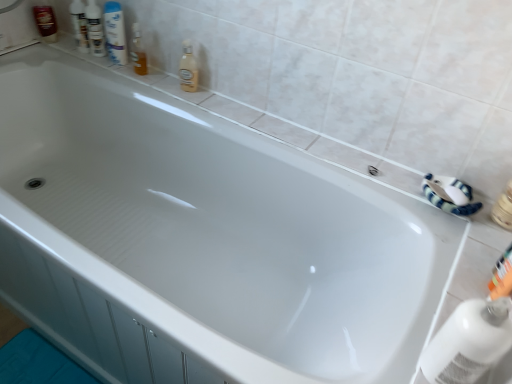
Describe the element at coordinates (46, 22) in the screenshot. I see `shiny brown bottle at upper left, the 5th toiletry viewed from the right` at that location.

The height and width of the screenshot is (384, 512). What do you see at coordinates (138, 51) in the screenshot?
I see `translucent plastic soap dispenser at upper center, placed as the second toiletry when sorted from front to back` at bounding box center [138, 51].

This screenshot has height=384, width=512. What do you see at coordinates (95, 29) in the screenshot?
I see `matte white pump bottle at upper left, marked as the third toiletry in a right-to-left arrangement` at bounding box center [95, 29].

What is the approximate height of white glossy shampoo bottles at upper left, the 4th toiletry positioned from the bottom?

white glossy shampoo bottles at upper left, the 4th toiletry positioned from the bottom, is 20.08 centimeters tall.

The width and height of the screenshot is (512, 384). Describe the element at coordinates (469, 342) in the screenshot. I see `transparent plastic bottle at lower right, which appears as the 2th cleaning product when viewed from the top` at that location.

Where is `shiny brown bottle at upper left, the first toiletry in the top-to-bottom sequence`? shiny brown bottle at upper left, the first toiletry in the top-to-bottom sequence is located at coordinates (46, 22).

Who is shorter, translucent plastic bottle at upper center, arranged as the 1th cleaning product when viewed from the back, or orange plastic toothbrush at lower right, which ranks as the first toiletry in right-to-left order?

orange plastic toothbrush at lower right, which ranks as the first toiletry in right-to-left order, is shorter.

Can you confirm if translucent plastic bottle at upper center, which appears as the first cleaning product when viewed from the left, is bigger than orange plastic toothbrush at lower right, the 1th toiletry in the bottom-to-top sequence?

Correct, translucent plastic bottle at upper center, which appears as the first cleaning product when viewed from the left, is larger in size than orange plastic toothbrush at lower right, the 1th toiletry in the bottom-to-top sequence.

Between translucent plastic bottle at upper center, which appears as the first cleaning product when viewed from the left, and orange plastic toothbrush at lower right, the fifth toiletry from the left, which one has larger width?

translucent plastic bottle at upper center, which appears as the first cleaning product when viewed from the left.

Could you tell me if translucent plastic bottle at upper center, which ranks as the second cleaning product in bottom-to-top order, is turned towards orange plastic toothbrush at lower right, positioned as the first toiletry in front-to-back order?

No, translucent plastic bottle at upper center, which ranks as the second cleaning product in bottom-to-top order, is not oriented towards orange plastic toothbrush at lower right, positioned as the first toiletry in front-to-back order.

Considering the points (187, 62) and (124, 52), which point is in front, point (187, 62) or point (124, 52)?

The point (187, 62) is more forward.

Does translucent plastic bottle at upper center, which appears as the first cleaning product when viewed from the left, have a lesser height compared to white glossy mouthwash at upper left?

Indeed, translucent plastic bottle at upper center, which appears as the first cleaning product when viewed from the left, has a lesser height compared to white glossy mouthwash at upper left.

Could white glossy mouthwash at upper left be considered to be inside translucent plastic bottle at upper center, which is counted as the second cleaning product, starting from the front?

No, translucent plastic bottle at upper center, which is counted as the second cleaning product, starting from the front, does not contain white glossy mouthwash at upper left.

Between translucent plastic bottle at upper center, which is counted as the second cleaning product, starting from the front, and white glossy mouthwash at upper left, which one appears on the left side from the viewer's perspective?

white glossy mouthwash at upper left.

In terms of size, does translucent plastic soap dispenser at upper center, the second toiletry positioned from the right, appear bigger or smaller than transparent plastic bottle at lower right, the second cleaning product from the left?

Considering their sizes, translucent plastic soap dispenser at upper center, the second toiletry positioned from the right, takes up less space than transparent plastic bottle at lower right, the second cleaning product from the left.

Would you say transparent plastic bottle at lower right, placed as the 1th cleaning product when sorted from right to left, is part of translucent plastic soap dispenser at upper center, placed as the second toiletry when sorted from bottom to top,'s contents?

No, transparent plastic bottle at lower right, placed as the 1th cleaning product when sorted from right to left, is located outside of translucent plastic soap dispenser at upper center, placed as the second toiletry when sorted from bottom to top.

Based on their positions, is translucent plastic soap dispenser at upper center, placed as the second toiletry when sorted from bottom to top, located to the left or right of transparent plastic bottle at lower right, the second cleaning product from the left?

Based on their positions, translucent plastic soap dispenser at upper center, placed as the second toiletry when sorted from bottom to top, is located to the left of transparent plastic bottle at lower right, the second cleaning product from the left.

Considering the points (146, 65) and (451, 374), which point is behind, point (146, 65) or point (451, 374)?

The point (146, 65) is farther from the camera.

Can you confirm if orange plastic toothbrush at lower right, the fifth toiletry from the left, is taller than translucent plastic soap dispenser at upper center, positioned as the 4th toiletry in left-to-right order?

No.

Between orange plastic toothbrush at lower right, positioned as the first toiletry in front-to-back order, and translucent plastic soap dispenser at upper center, placed as the 4th toiletry when sorted from back to front, which one has larger size?

translucent plastic soap dispenser at upper center, placed as the 4th toiletry when sorted from back to front.

Is orange plastic toothbrush at lower right, which ranks as the first toiletry in right-to-left order, far from translucent plastic soap dispenser at upper center, placed as the second toiletry when sorted from bottom to top?

Yes, orange plastic toothbrush at lower right, which ranks as the first toiletry in right-to-left order, is far from translucent plastic soap dispenser at upper center, placed as the second toiletry when sorted from bottom to top.

Could you measure the distance between transparent plastic bottle at lower right, marked as the 2th cleaning product in a back-to-front arrangement, and shiny brown bottle at upper left, the first toiletry in the top-to-bottom sequence?

transparent plastic bottle at lower right, marked as the 2th cleaning product in a back-to-front arrangement, and shiny brown bottle at upper left, the first toiletry in the top-to-bottom sequence, are 1.74 meters apart from each other.

Locate an element on the screen. Image resolution: width=512 pixels, height=384 pixels. the 2nd toiletry directly beneath the transparent plastic bottle at lower right, the second cleaning product from the left (from a real-world perspective) is located at coordinates (46, 22).

Which object is further away from the camera, transparent plastic bottle at lower right, which appears as the 2th cleaning product when viewed from the top, or shiny brown bottle at upper left, the 5th toiletry viewed from the right?

Answer: shiny brown bottle at upper left, the 5th toiletry viewed from the right, is more distant.

Is transparent plastic bottle at lower right, which appears as the 2th cleaning product when viewed from the top, taller or shorter than shiny brown bottle at upper left, the fifth toiletry viewed from the front?

Clearly, transparent plastic bottle at lower right, which appears as the 2th cleaning product when viewed from the top, is taller compared to shiny brown bottle at upper left, the fifth toiletry viewed from the front.

Which point is more forward, (44, 6) or (451, 359)?

The point (451, 359) is closer.

Is shiny brown bottle at upper left, the 5th toiletry viewed from the right, wider than transparent plastic bottle at lower right, which appears as the 1th cleaning product when viewed from the front?

No, shiny brown bottle at upper left, the 5th toiletry viewed from the right, is not wider than transparent plastic bottle at lower right, which appears as the 1th cleaning product when viewed from the front.

Measure the distance between shiny brown bottle at upper left, arranged as the 1th toiletry when viewed from the left, and transparent plastic bottle at lower right, which appears as the 2th cleaning product when viewed from the top.

A distance of 5.71 feet exists between shiny brown bottle at upper left, arranged as the 1th toiletry when viewed from the left, and transparent plastic bottle at lower right, which appears as the 2th cleaning product when viewed from the top.

Is shiny brown bottle at upper left, the fifth toiletry in the bottom-to-top sequence, oriented towards transparent plastic bottle at lower right, marked as the first cleaning product in a bottom-to-top arrangement?

Result: Yes, shiny brown bottle at upper left, the fifth toiletry in the bottom-to-top sequence, faces towards transparent plastic bottle at lower right, marked as the first cleaning product in a bottom-to-top arrangement.

Considering the relative positions of orange plastic toothbrush at lower right, which is the 5th toiletry in top-to-bottom order, and matte white pump bottle at upper left, acting as the 3th toiletry starting from the top, in the image provided, is orange plastic toothbrush at lower right, which is the 5th toiletry in top-to-bottom order, to the left of matte white pump bottle at upper left, acting as the 3th toiletry starting from the top, from the viewer's perspective?

Incorrect, orange plastic toothbrush at lower right, which is the 5th toiletry in top-to-bottom order, is not on the left side of matte white pump bottle at upper left, acting as the 3th toiletry starting from the top.

In terms of size, does orange plastic toothbrush at lower right, which ranks as the first toiletry in right-to-left order, appear bigger or smaller than matte white pump bottle at upper left, the 3th toiletry when ordered from front to back?

Clearly, orange plastic toothbrush at lower right, which ranks as the first toiletry in right-to-left order, is smaller in size than matte white pump bottle at upper left, the 3th toiletry when ordered from front to back.

Considering the positions of point (501, 286) and point (99, 55), is point (501, 286) closer or farther from the camera than point (99, 55)?

Point (501, 286) is closer to the camera than point (99, 55).

Identify the location of toiletry that is the 3rd one below the translucent plastic bottle at upper center, the 2th cleaning product in the right-to-left sequence (from a real-world perspective). (502, 276).

The width and height of the screenshot is (512, 384). I want to click on mouthwash located behind the translucent plastic bottle at upper center, arranged as the 1th cleaning product when viewed from the back, so click(x=115, y=32).

Estimate the real-world distances between objects in this image. Which object is closer to translucent plastic soap dispenser at upper center, positioned as the 4th toiletry in left-to-right order, orange plastic toothbrush at lower right, positioned as the first toiletry in front-to-back order, or white glossy shampoo bottles at upper left, positioned as the second toiletry in back-to-front order?

Based on the image, white glossy shampoo bottles at upper left, positioned as the second toiletry in back-to-front order, appears to be nearer to translucent plastic soap dispenser at upper center, positioned as the 4th toiletry in left-to-right order.

When comparing their distances from translucent plastic bottle at upper center, which appears as the first cleaning product when viewed from the left, does matte white pump bottle at upper left, which is the 3th toiletry from bottom to top, or translucent plastic soap dispenser at upper center, the second toiletry positioned from the right, seem closer?

Based on the image, translucent plastic soap dispenser at upper center, the second toiletry positioned from the right, appears to be nearer to translucent plastic bottle at upper center, which appears as the first cleaning product when viewed from the left.

Which object lies further to the anchor point matte white pump bottle at upper left, marked as the third toiletry in a right-to-left arrangement, orange plastic toothbrush at lower right, the fifth toiletry from the left, or transparent plastic bottle at lower right, the second cleaning product from the left?

transparent plastic bottle at lower right, the second cleaning product from the left, is positioned further to the anchor matte white pump bottle at upper left, marked as the third toiletry in a right-to-left arrangement.

When comparing their distances from matte white pump bottle at upper left, the 3th toiletry when ordered from front to back, does translucent plastic bottle at upper center, which appears as the first cleaning product when viewed from the left, or orange plastic toothbrush at lower right, which is the 5th toiletry in top-to-bottom order, seem closer?

Among the two, translucent plastic bottle at upper center, which appears as the first cleaning product when viewed from the left, is located nearer to matte white pump bottle at upper left, the 3th toiletry when ordered from front to back.

From the image, which object appears to be farther from matte white pump bottle at upper left, acting as the 3th toiletry starting from the top, transparent plastic bottle at lower right, which appears as the 1th cleaning product when viewed from the front, or translucent plastic bottle at upper center, which is counted as the second cleaning product, starting from the front?

The object further to matte white pump bottle at upper left, acting as the 3th toiletry starting from the top, is transparent plastic bottle at lower right, which appears as the 1th cleaning product when viewed from the front.

Which object lies further to the anchor point white glossy shampoo bottles at upper left, the 4th toiletry positioned from the bottom, white glossy mouthwash at upper left or orange plastic toothbrush at lower right, which ranks as the first toiletry in right-to-left order?

orange plastic toothbrush at lower right, which ranks as the first toiletry in right-to-left order.

Considering their positions, is translucent plastic bottle at upper center, which appears as the first cleaning product when viewed from the left, positioned closer to shiny brown bottle at upper left, the first toiletry when ordered from back to front, than matte white pump bottle at upper left, the 3th toiletry positioned from the back?

matte white pump bottle at upper left, the 3th toiletry positioned from the back, is positioned closer to the anchor shiny brown bottle at upper left, the first toiletry when ordered from back to front.

Looking at the image, which one is located further to matte white pump bottle at upper left, marked as the third toiletry in a right-to-left arrangement, orange plastic toothbrush at lower right, positioned as the first toiletry in front-to-back order, or translucent plastic bottle at upper center, which is counted as the second cleaning product, starting from the front?

Based on the image, orange plastic toothbrush at lower right, positioned as the first toiletry in front-to-back order, appears to be further to matte white pump bottle at upper left, marked as the third toiletry in a right-to-left arrangement.

This screenshot has height=384, width=512. What are the coordinates of `mouthwash between white glossy shampoo bottles at upper left, which appears as the 4th toiletry when viewed from the front, and translucent plastic bottle at upper center, placed as the first cleaning product when sorted from top to bottom, in the horizontal direction` in the screenshot? It's located at (115, 32).

This screenshot has height=384, width=512. I want to click on mouthwash located between shiny brown bottle at upper left, the first toiletry in the top-to-bottom sequence, and orange plastic toothbrush at lower right, which is the 5th toiletry in top-to-bottom order, in the left-right direction, so click(115, 32).

You are a GUI agent. You are given a task and a screenshot of the screen. Output one action in this format:
    pyautogui.click(x=<x>, y=<y>)
    Task: Click on the toiletry between white glossy shampoo bottles at upper left, which ranks as the fourth toiletry in right-to-left order, and translucent plastic soap dispenser at upper center, positioned as the 4th toiletry in left-to-right order, from left to right
    This screenshot has height=384, width=512.
    Given the screenshot: What is the action you would take?
    pyautogui.click(x=95, y=29)

Image resolution: width=512 pixels, height=384 pixels. Find the location of `cleaning product situated between matte white pump bottle at upper left, the 3th toiletry positioned from the back, and transparent plastic bottle at lower right, which appears as the 1th cleaning product when viewed from the front, from left to right`. cleaning product situated between matte white pump bottle at upper left, the 3th toiletry positioned from the back, and transparent plastic bottle at lower right, which appears as the 1th cleaning product when viewed from the front, from left to right is located at coordinates (188, 69).